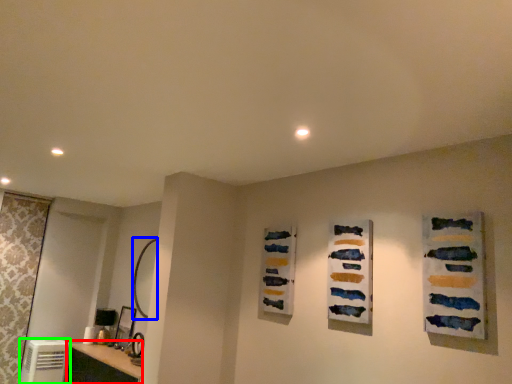
Question: Based on their relative distances, which object is farther from vanity (highlighted by a red box)? Choose from mirror (highlighted by a blue box) and appliance (highlighted by a green box).

Choices:
 (A) mirror
 (B) appliance

Answer: (A)